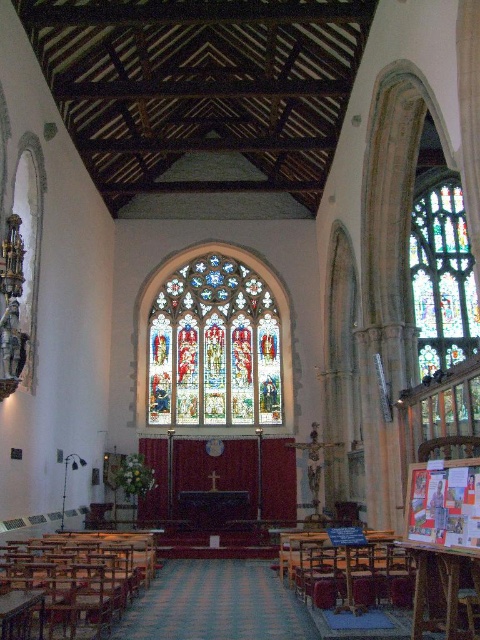
Who is shorter, wooden polished chair at lower left or stained glass window at right?

wooden polished chair at lower left is shorter.

Between wooden polished chair at lower left and stained glass window at right, which one is positioned higher?

stained glass window at right is above.

Describe the element at coordinates (81, 576) in the screenshot. I see `wooden polished chair at lower left` at that location.

This screenshot has width=480, height=640. Identify the location of wooden polished chair at lower left. (81, 576).

Does stained glass window at center have a lesser width compared to wooden chair at lower center?

No, stained glass window at center is not thinner than wooden chair at lower center.

Does point (271, 294) come closer to viewer compared to point (279, 563)?

No, it is not.

Is point (155, 316) positioned before point (321, 589)?

No, it is not.

The image size is (480, 640). In order to click on stained glass window at center in this screenshot , I will do `click(214, 346)`.

Based on the photo, is wooden polished chair at lower left further to camera compared to wooden chair at lower center?

No, it is in front of wooden chair at lower center.

Can you confirm if wooden polished chair at lower left is positioned to the right of wooden chair at lower center?

No, wooden polished chair at lower left is not to the right of wooden chair at lower center.

Is point (19, 550) more distant than point (358, 552)?

No, it is in front of (358, 552).

Where is `wooden polished chair at lower left`? wooden polished chair at lower left is located at coordinates (81, 576).